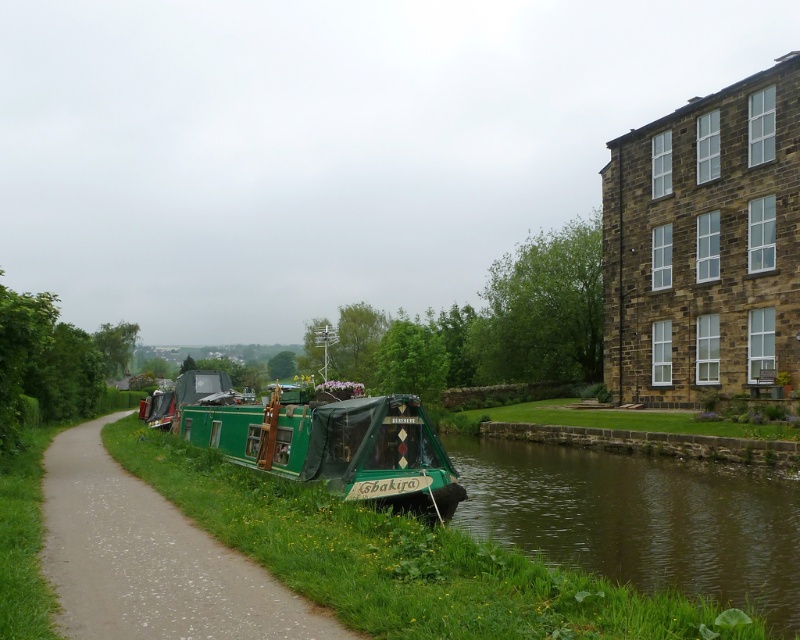
You are a photographer positioned at the origin point of the image coordinate system. You want to capture a photo of the green canvas boat at center. What are the coordinates where you should aim your camera?

The coordinates to aim your camera are at point (150, 560) to capture the green canvas boat at center.

You are a photographer planning to capture a wide shot of the green canvas boat at center and the green grassy river at lower right. Based on the scene, which of these two elements will appear narrower in your photograph?

The green grassy river at lower right will appear narrower in the photograph because it is thinner than the green canvas boat at center.

You are a delivery drone that needs to fly from the green grassy river at lower right to the green canvas barge at center. Can you fit through the space between them without touching either?

The green grassy river at lower right is wider than the green canvas barge at center, so the space between them allows the drone to pass safely without touching either.